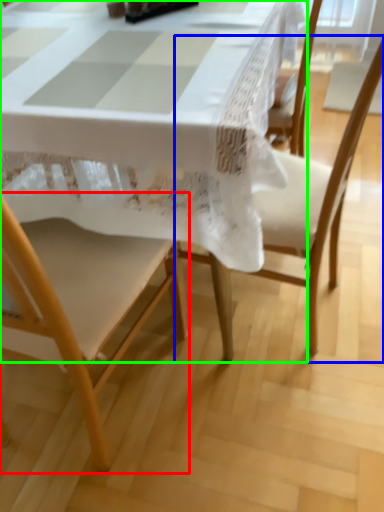
Question: Estimate the real-world distances between objects in this image. Which object is farther from chair (highlighted by a red box), chair (highlighted by a blue box) or table (highlighted by a green box)?

Choices:
 (A) chair
 (B) table

Answer: (A)